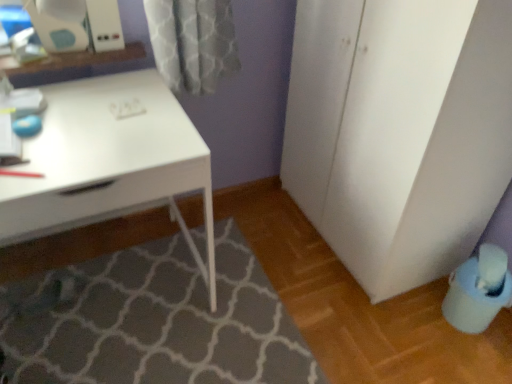
Where is `free space in front of white matte cabinet at right`? free space in front of white matte cabinet at right is located at coordinates (377, 324).